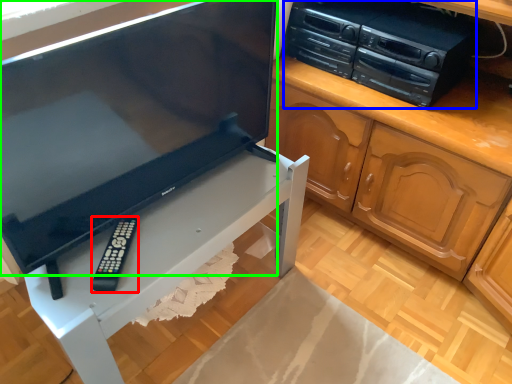
Question: Which is farther away from remote (highlighted by a red box)? home appliance (highlighted by a blue box) or television (highlighted by a green box)?

Choices:
 (A) home appliance
 (B) television

Answer: (A)